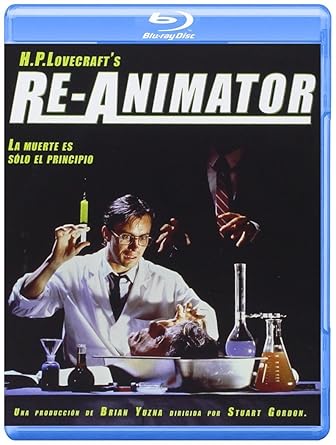
The image size is (336, 445). I want to click on glass containers, so click(x=40, y=373), click(x=81, y=372), click(x=242, y=346), click(x=288, y=362).